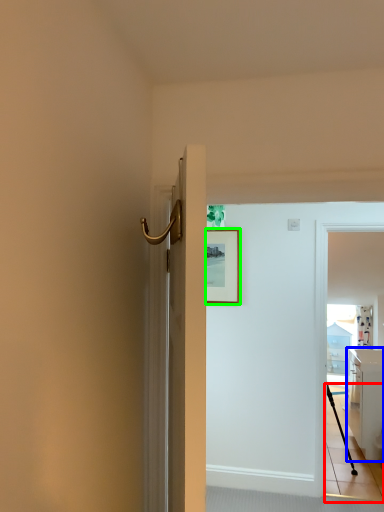
Question: Which is nearer to the path (highlighted by a red box)? cabinetry (highlighted by a blue box) or picture frame (highlighted by a green box).

Choices:
 (A) cabinetry
 (B) picture frame

Answer: (A)